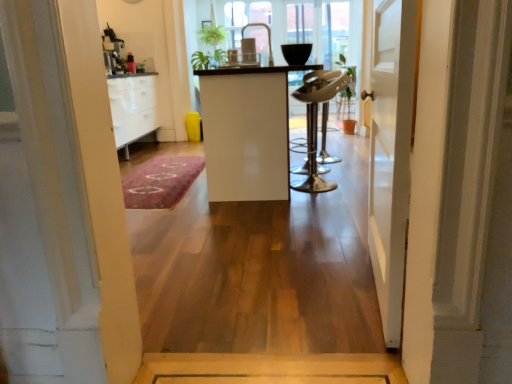
Question: Is white glossy cabinet at center facing towards white wooden door at center?

Choices:
 (A) no
 (B) yes

Answer: (A)

Question: Does white glossy cabinet at center lie in front of white wooden door at center?

Choices:
 (A) yes
 (B) no

Answer: (B)

Question: Can you confirm if white glossy cabinet at center is smaller than white wooden door at center?

Choices:
 (A) no
 (B) yes

Answer: (A)

Question: From a real-world perspective, is white glossy cabinet at center beneath white wooden door at center?

Choices:
 (A) no
 (B) yes

Answer: (B)

Question: Can you confirm if white glossy cabinet at center is positioned to the right of white wooden door at center?

Choices:
 (A) no
 (B) yes

Answer: (A)

Question: From a real-world perspective, is white wooden door at center above or below shiny metallic bar stool at center?

Choices:
 (A) below
 (B) above

Answer: (B)

Question: In terms of height, does white wooden door at center look taller or shorter compared to shiny metallic bar stool at center?

Choices:
 (A) tall
 (B) short

Answer: (A)

Question: Is white wooden door at center to the left or to the right of shiny metallic bar stool at center in the image?

Choices:
 (A) right
 (B) left

Answer: (A)

Question: Relative to shiny metallic bar stool at center, is white wooden door at center in front or behind?

Choices:
 (A) behind
 (B) front

Answer: (B)

Question: Choose the correct answer: Is shiny metallic bar stool at center inside white wooden door at center or outside it?

Choices:
 (A) outside
 (B) inside

Answer: (A)

Question: Would you say shiny metallic bar stool at center is to the left or to the right of white wooden door at center in the picture?

Choices:
 (A) right
 (B) left

Answer: (B)

Question: Considering their positions, is shiny metallic bar stool at center located in front of or behind white wooden door at center?

Choices:
 (A) front
 (B) behind

Answer: (B)

Question: From a real-world perspective, is shiny metallic bar stool at center positioned above or below white wooden door at center?

Choices:
 (A) above
 (B) below

Answer: (B)

Question: Is point (318, 185) positioned closer to the camera than point (186, 175)?

Choices:
 (A) closer
 (B) farther

Answer: (A)

Question: Looking at their shapes, would you say shiny metallic bar stool at center is wider or thinner than pink carpet at center?

Choices:
 (A) thin
 (B) wide

Answer: (A)